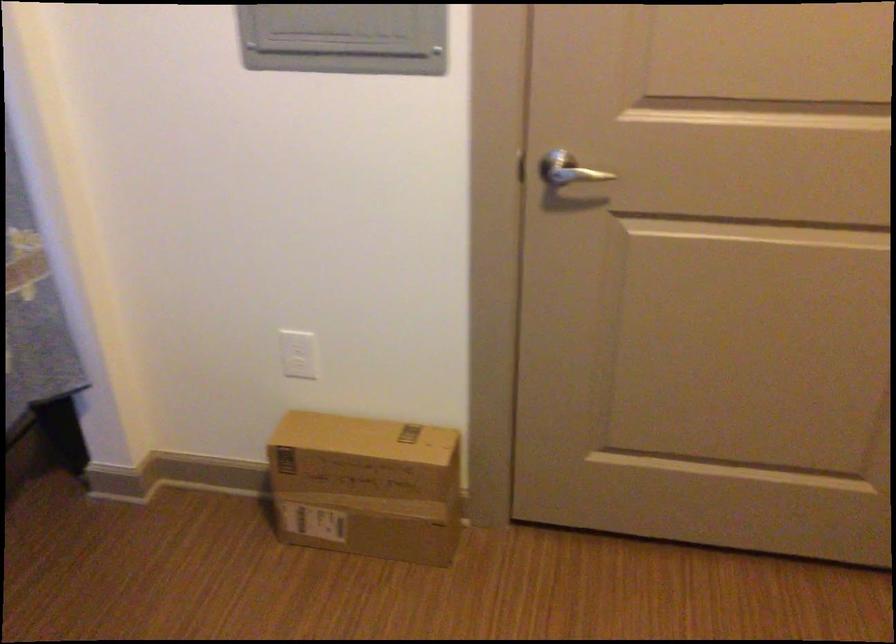
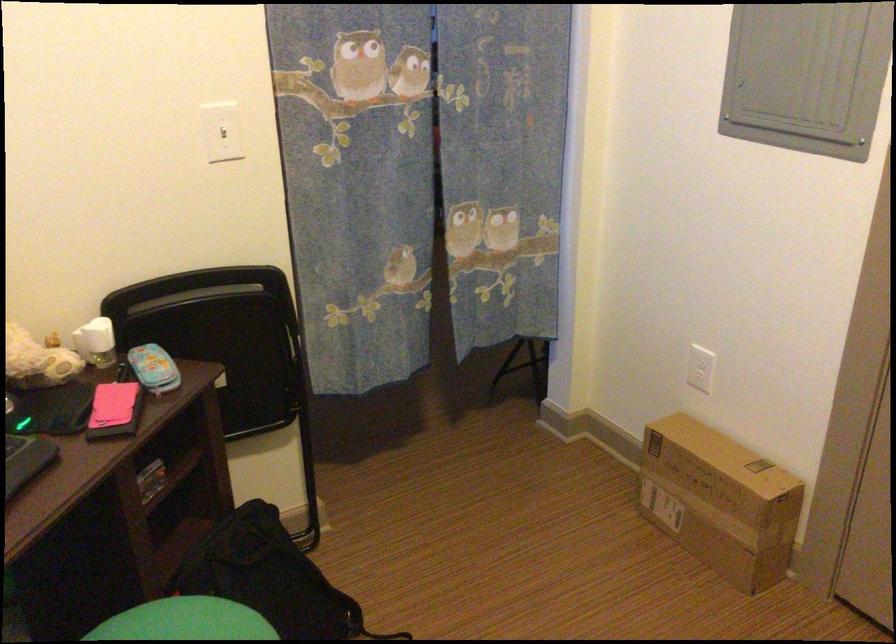
In the second image, find the point that corresponds to pixel 385 495 in the first image.

(719, 500)